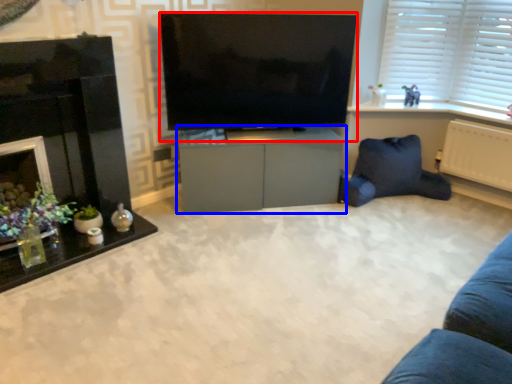
Question: Among these objects, which one is nearest to the camera, television (highlighted by a red box) or cabinetry (highlighted by a blue box)?

Choices:
 (A) television
 (B) cabinetry

Answer: (A)